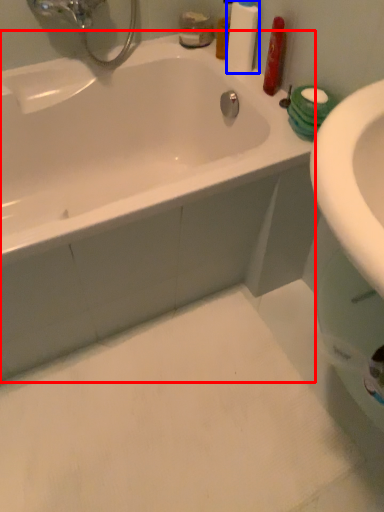
Question: Which point is closer to the camera, bathtub (highlighted by a red box) or cleaning product (highlighted by a blue box)?

Choices:
 (A) bathtub
 (B) cleaning product

Answer: (A)